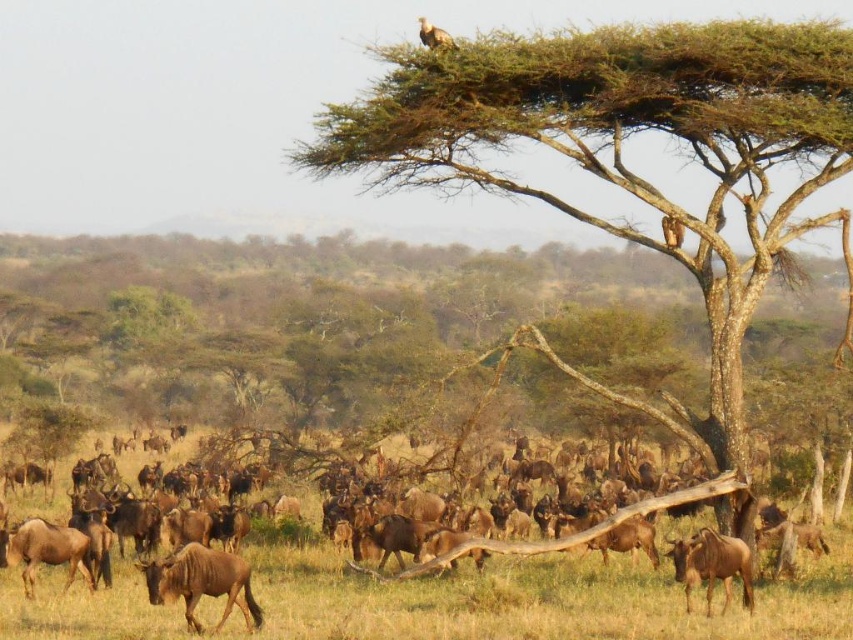
Which is more to the right, brown dry grass at center or brown matte/glossy wildebeest at lower left?

brown dry grass at center

Is brown dry grass at center wider than brown matte/glossy wildebeest at lower left?

Yes.

Between point (595, 593) and point (172, 595), which one is positioned behind?

Positioned behind is point (595, 593).

The image size is (853, 640). I want to click on brown dry grass at center, so click(x=540, y=600).

Is brown matte/glossy wildebeest at lower right wider than brown textured bird at upper center?

Incorrect, brown matte/glossy wildebeest at lower right's width does not surpass brown textured bird at upper center's.

Looking at this image, which is above, brown matte/glossy wildebeest at lower right or brown textured bird at upper center?

brown textured bird at upper center is higher up.

Where is `brown matte/glossy wildebeest at lower right`? brown matte/glossy wildebeest at lower right is located at coordinates (712, 564).

Is brown textured tree at upper center to the left of brown textured bird at upper center from the viewer's perspective?

Incorrect, brown textured tree at upper center is not on the left side of brown textured bird at upper center.

Locate an element on the screen. The height and width of the screenshot is (640, 853). brown textured tree at upper center is located at coordinates (621, 154).

Between point (720, 112) and point (440, 36), which one is positioned behind?

Positioned behind is point (440, 36).

Locate an element on the screen. This screenshot has width=853, height=640. brown textured tree at upper center is located at coordinates (621, 154).